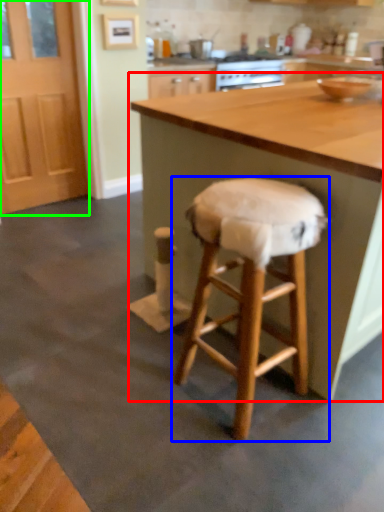
Question: Based on their relative distances, which object is farther from table (highlighted by a red box)? Choose from stool (highlighted by a blue box) and screen door (highlighted by a green box).

Choices:
 (A) stool
 (B) screen door

Answer: (B)